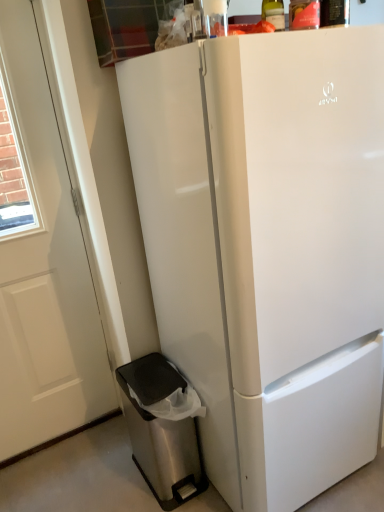
Question: From the image's perspective, is white glossy refrigerator at center positioned above or below white matte door at left?

Choices:
 (A) above
 (B) below

Answer: (B)

Question: In terms of height, does white glossy refrigerator at center look taller or shorter compared to white matte door at left?

Choices:
 (A) short
 (B) tall

Answer: (A)

Question: Estimate the real-world distances between objects in this image. Which object is closer to the white matte door at left?

Choices:
 (A) white glossy refrigerator at center
 (B) translucent glass bottle at upper center
 (C) stainless steel trash can at lower left

Answer: (C)

Question: Estimate the real-world distances between objects in this image. Which object is farther from the translucent glass bottle at upper center?

Choices:
 (A) stainless steel trash can at lower left
 (B) white matte door at left
 (C) white glossy refrigerator at center

Answer: (A)